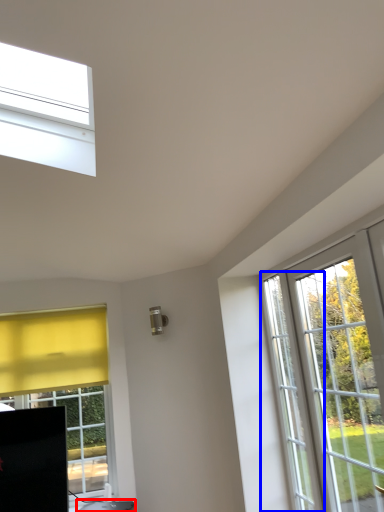
Question: Which object appears closest to the camera in this image, furniture (highlighted by a red box) or screen door (highlighted by a blue box)?

Choices:
 (A) furniture
 (B) screen door

Answer: (B)